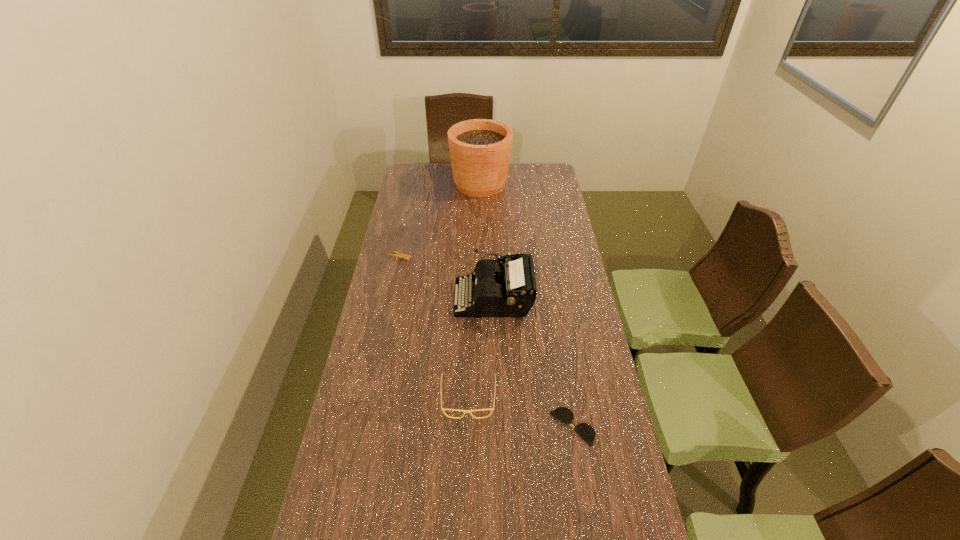
Where is `flowerpot`? This screenshot has width=960, height=540. flowerpot is located at coordinates (480, 149).

Find the location of a particular element. The width and height of the screenshot is (960, 540). the farthest object is located at coordinates (480, 149).

Locate an element on the screen. typewriter is located at coordinates (508, 289).

Locate an element on the screen. Image resolution: width=960 pixels, height=540 pixels. the second tallest object is located at coordinates (508, 289).

Locate an element on the screen. The image size is (960, 540). the left spectacles is located at coordinates (465, 411).

Identify the location of the taller spectacles. The width and height of the screenshot is (960, 540). coord(465,411).

Identify the location of the second farthest object. The image size is (960, 540). (399, 255).

This screenshot has width=960, height=540. In order to click on the leftmost object in this screenshot , I will do `click(399, 255)`.

This screenshot has height=540, width=960. Find the location of `the right spectacles`. the right spectacles is located at coordinates (585, 431).

Where is `the shorter spectacles`? the shorter spectacles is located at coordinates pos(585,431).